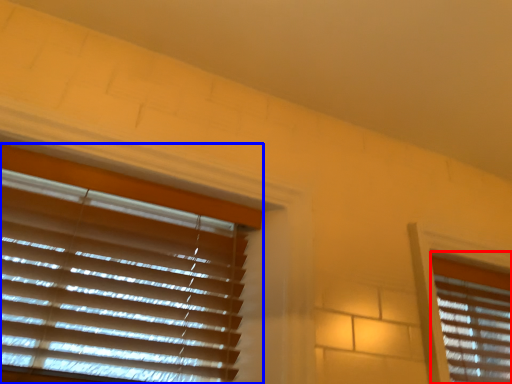
Question: Which object is closer to the camera taking this photo, window blind (highlighted by a red box) or window blind (highlighted by a blue box)?

Choices:
 (A) window blind
 (B) window blind

Answer: (B)